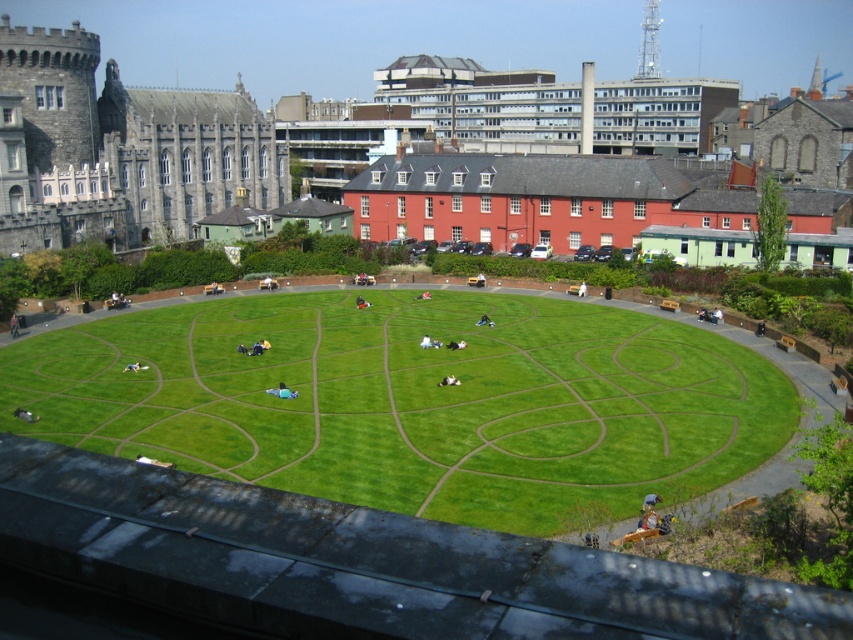
Between point (650, 512) and point (585, 289), which one is positioned behind?

The point (585, 289) is more distant.

Is point (648, 497) behind point (583, 291)?

That is False.

This screenshot has width=853, height=640. What are the coordinates of `blue denim jacket at lower right` in the screenshot? It's located at (648, 512).

Is point (653, 403) positioned after point (648, 520)?

Yes, it is behind point (648, 520).

Who is higher up, green grass at center or blue denim jacket at lower right?

Positioned higher is green grass at center.

Is point (62, 353) farther from viewer compared to point (659, 499)?

Yes, it is.

Locate an element on the screen. This screenshot has width=853, height=640. green grass at center is located at coordinates (415, 401).

Can you confirm if blue denim jacket at lower right is bigger than light blue fabric at center?

Yes, blue denim jacket at lower right is bigger than light blue fabric at center.

Does blue denim jacket at lower right have a greater height compared to light blue fabric at center?

Yes, blue denim jacket at lower right is taller than light blue fabric at center.

The width and height of the screenshot is (853, 640). Describe the element at coordinates (648, 512) in the screenshot. I see `blue denim jacket at lower right` at that location.

Locate an element on the screen. The height and width of the screenshot is (640, 853). blue denim jacket at lower right is located at coordinates (648, 512).